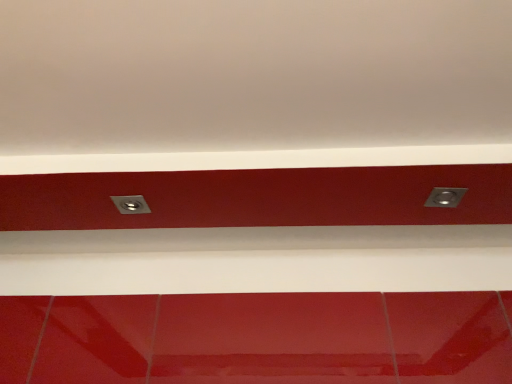
Question: Is metallic silver power plug/socket at upper right, which appears as the second power plugs and sockets when viewed from the left, oriented towards metallic silver socket at center, positioned as the 1th power plugs and sockets in left-to-right order?

Choices:
 (A) yes
 (B) no

Answer: (B)

Question: Is metallic silver power plug/socket at upper right, the 1th power plugs and sockets viewed from the right, further to camera compared to metallic silver socket at center, the second power plugs and sockets viewed from the right?

Choices:
 (A) no
 (B) yes

Answer: (A)

Question: From a real-world perspective, is metallic silver power plug/socket at upper right, the 1th power plugs and sockets viewed from the right, on top of metallic silver socket at center, positioned as the 1th power plugs and sockets in left-to-right order?

Choices:
 (A) no
 (B) yes

Answer: (A)

Question: From a real-world perspective, is metallic silver power plug/socket at upper right, which appears as the second power plugs and sockets when viewed from the left, physically below metallic silver socket at center, the second power plugs and sockets viewed from the right?

Choices:
 (A) no
 (B) yes

Answer: (B)

Question: Is metallic silver power plug/socket at upper right, the 1th power plugs and sockets viewed from the right, positioned with its back to metallic silver socket at center, the second power plugs and sockets viewed from the right?

Choices:
 (A) yes
 (B) no

Answer: (B)

Question: Does metallic silver power plug/socket at upper right, which appears as the second power plugs and sockets when viewed from the left, have a greater width compared to metallic silver socket at center, the second power plugs and sockets viewed from the right?

Choices:
 (A) yes
 (B) no

Answer: (B)

Question: From a real-world perspective, is metallic silver socket at center, the second power plugs and sockets viewed from the right, over metallic silver power plug/socket at upper right, the 1th power plugs and sockets viewed from the right?

Choices:
 (A) no
 (B) yes

Answer: (B)

Question: Does metallic silver socket at center, the second power plugs and sockets viewed from the right, have a lesser width compared to metallic silver power plug/socket at upper right, the 1th power plugs and sockets viewed from the right?

Choices:
 (A) no
 (B) yes

Answer: (A)

Question: Is metallic silver socket at center, positioned as the 1th power plugs and sockets in left-to-right order, placed right next to metallic silver power plug/socket at upper right, the 1th power plugs and sockets viewed from the right?

Choices:
 (A) no
 (B) yes

Answer: (A)

Question: Is metallic silver socket at center, the second power plugs and sockets viewed from the right, positioned in front of metallic silver power plug/socket at upper right, which appears as the second power plugs and sockets when viewed from the left?

Choices:
 (A) no
 (B) yes

Answer: (A)

Question: Is metallic silver socket at center, the second power plugs and sockets viewed from the right, bigger than metallic silver power plug/socket at upper right, which appears as the second power plugs and sockets when viewed from the left?

Choices:
 (A) no
 (B) yes

Answer: (A)

Question: Does metallic silver socket at center, the second power plugs and sockets viewed from the right, have a greater height compared to metallic silver power plug/socket at upper right, which appears as the second power plugs and sockets when viewed from the left?

Choices:
 (A) no
 (B) yes

Answer: (A)

Question: From the image's perspective, is metallic silver socket at center, positioned as the 1th power plugs and sockets in left-to-right order, located above or below metallic silver power plug/socket at upper right, which appears as the second power plugs and sockets when viewed from the left?

Choices:
 (A) below
 (B) above

Answer: (A)